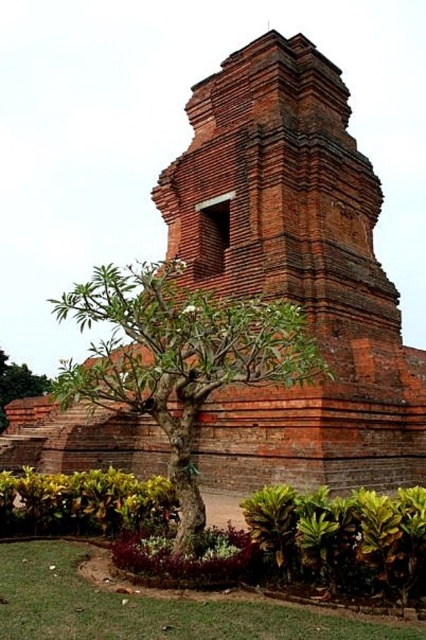
Question: Which object is closer to the camera taking this photo?

Choices:
 (A) green leafy tree at center
 (B) green leafy shrub at lower left
 (C) green leafy tree at lower left
 (D) green leafy shrub at lower right

Answer: (D)

Question: Estimate the real-world distances between objects in this image. Which object is closer to the green leafy tree at center?

Choices:
 (A) green leafy tree at lower left
 (B) green leafy shrub at lower left
 (C) green leafy shrub at lower right

Answer: (B)

Question: Does green leafy shrub at lower left have a smaller size compared to green leafy tree at lower left?

Choices:
 (A) yes
 (B) no

Answer: (A)

Question: Is green leafy tree at center wider than green leafy shrub at lower left?

Choices:
 (A) yes
 (B) no

Answer: (A)

Question: Is green leafy tree at center closer to the viewer compared to green leafy shrub at lower right?

Choices:
 (A) yes
 (B) no

Answer: (B)

Question: Which point is closer to the camera?

Choices:
 (A) green leafy tree at center
 (B) green leafy shrub at lower left
 (C) green leafy shrub at lower right
 (D) green leafy tree at lower left

Answer: (C)